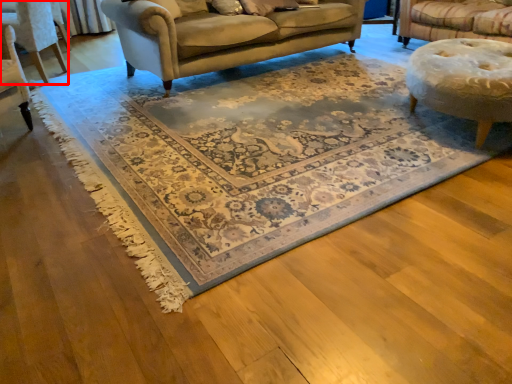
Question: From the image's perspective, where is chair (annotated by the red box) located relative to mat?

Choices:
 (A) above
 (B) below

Answer: (A)